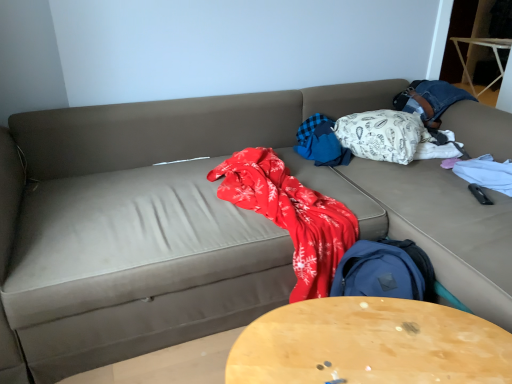
Question: From a real-world perspective, is blue plaid blanket at center, arranged as the first blanket when viewed from the left, located beneath wooden round table at center?

Choices:
 (A) no
 (B) yes

Answer: (A)

Question: From the image's perspective, would you say blue plaid blanket at center, arranged as the first blanket when viewed from the left, is positioned over wooden round table at center?

Choices:
 (A) no
 (B) yes

Answer: (B)

Question: Is blue plaid blanket at center, arranged as the first blanket when viewed from the left, surrounding wooden round table at center?

Choices:
 (A) yes
 (B) no

Answer: (B)

Question: Does blue plaid blanket at center, arranged as the first blanket when viewed from the left, have a smaller size compared to wooden round table at center?

Choices:
 (A) no
 (B) yes

Answer: (B)

Question: Considering the relative positions of blue plaid blanket at center, arranged as the first blanket when viewed from the left, and wooden round table at center in the image provided, is blue plaid blanket at center, arranged as the first blanket when viewed from the left, to the left of wooden round table at center from the viewer's perspective?

Choices:
 (A) no
 (B) yes

Answer: (A)

Question: Is blue plaid blanket at center, which appears as the second blanket when viewed from the right, taller than wooden round table at center?

Choices:
 (A) no
 (B) yes

Answer: (A)

Question: Considering the relative sizes of white patterned fabric at upper right, acting as the second blanket starting from the left, and blue plaid blanket at center, which appears as the second blanket when viewed from the right, in the image provided, is white patterned fabric at upper right, acting as the second blanket starting from the left, wider than blue plaid blanket at center, which appears as the second blanket when viewed from the right,?

Choices:
 (A) no
 (B) yes

Answer: (B)

Question: Does white patterned fabric at upper right, acting as the second blanket starting from the left, have a lesser height compared to blue plaid blanket at center, arranged as the first blanket when viewed from the left?

Choices:
 (A) no
 (B) yes

Answer: (A)

Question: Is white patterned fabric at upper right, acting as the second blanket starting from the left, facing towards blue plaid blanket at center, arranged as the first blanket when viewed from the left?

Choices:
 (A) yes
 (B) no

Answer: (B)

Question: Does white patterned fabric at upper right, acting as the second blanket starting from the left, have a greater height compared to blue plaid blanket at center, arranged as the first blanket when viewed from the left?

Choices:
 (A) yes
 (B) no

Answer: (A)

Question: Is white patterned fabric at upper right, the first blanket when ordered from right to left, bigger than blue plaid blanket at center, which appears as the second blanket when viewed from the right?

Choices:
 (A) yes
 (B) no

Answer: (A)

Question: Is white patterned fabric at upper right, acting as the second blanket starting from the left, not within blue plaid blanket at center, arranged as the first blanket when viewed from the left?

Choices:
 (A) yes
 (B) no

Answer: (A)

Question: Considering the relative sizes of wooden round table at center and blue plaid blanket at center, which appears as the second blanket when viewed from the right, in the image provided, is wooden round table at center shorter than blue plaid blanket at center, which appears as the second blanket when viewed from the right,?

Choices:
 (A) no
 (B) yes

Answer: (A)